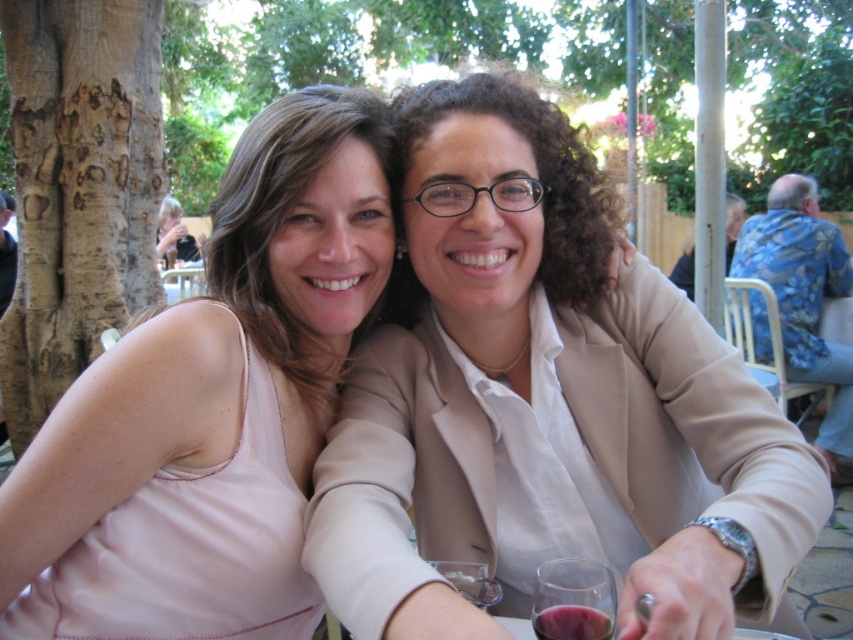
From the picture: You are a server at a restaurant and need to choose between the translucent glass wine at lower center and the transparent plastic wine glass at lower center for a customer. Which one is more suitable for serving wine?

The translucent glass wine at lower center is more suitable for serving wine because it is made of glass, which is the traditional and appropriate material for wine glasses, whereas the transparent plastic wine glass at lower center is made of plastic and may not provide the same aesthetic or functional qualities.

You are a photographer trying to capture the two individuals in the scene. You notice a point at coordinates (573, 600) which is part of the translucent glass at lower center. How might this affect your photography setup?

The point at coordinates (573, 600) corresponds to translucent glass at lower center, which may cause reflections or distortions in the photo. To mitigate this, adjust the camera angle or use a polarizing filter to reduce glare from the translucent glass at lower center.

You are a photographer standing at the camera position. You want to take a photo of the two people in the scene. However, there is a translucent glass wine at lower center that might block your view. Can you see both people clearly without moving the wine?

The translucent glass wine at lower center is 32.28 inches from the camera, so it is possible that the wine glass is between the camera and the people, potentially blocking part of the view. To ensure both people are visible clearly, you might need to adjust your position or move the wine glass slightly.